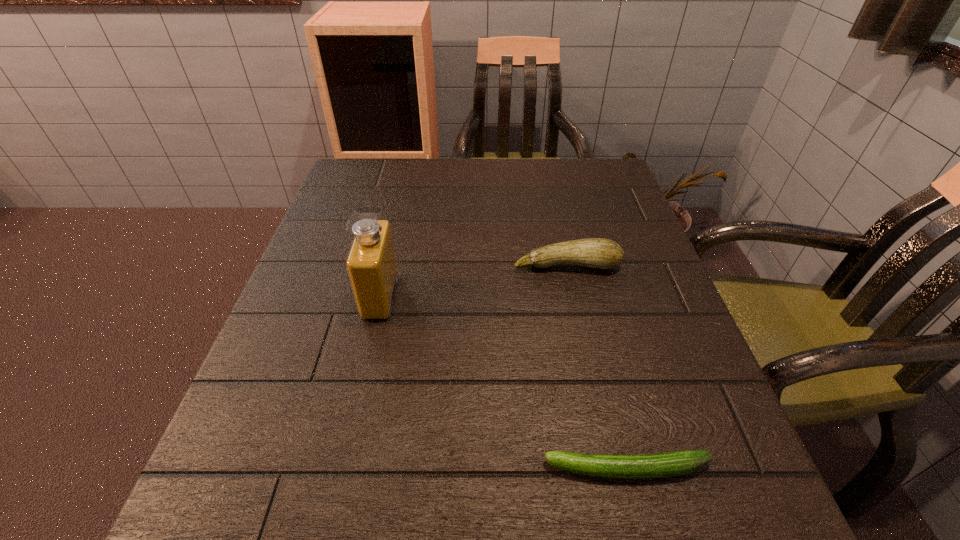
I want to click on the closest object to the farther zucchini, so pos(371,263).

In order to click on blank space that satisfies the following two spatial constraints: 1. at the stem end of the farther zucchini; 2. on the front-facing side of the leftmost object in this screenshot , I will do `click(573, 296)`.